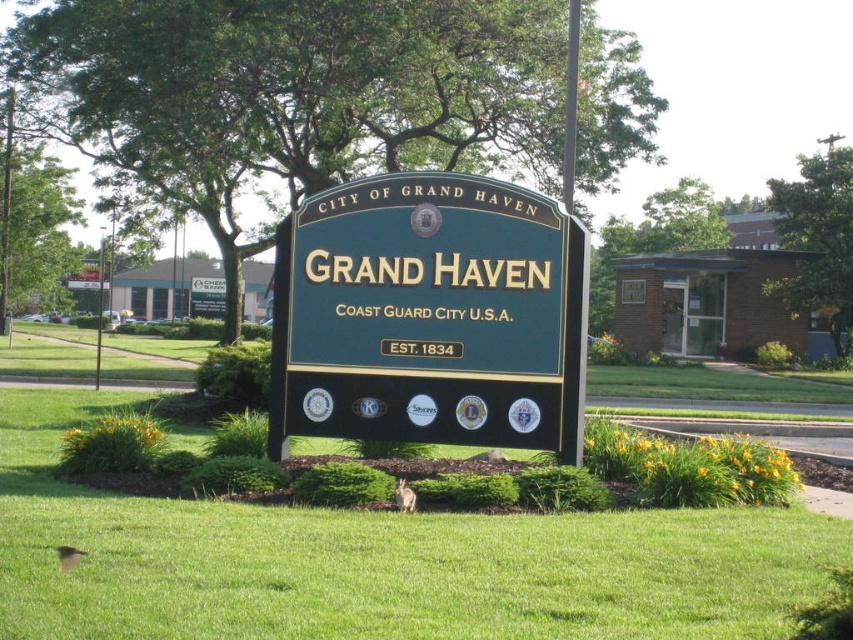
Question: Among these objects, which one is nearest to the camera?

Choices:
 (A) green polished wood sign at center
 (B) green grass at center

Answer: (B)

Question: Considering the relative positions of green grass at center and green polished wood sign at center in the image provided, where is green grass at center located with respect to green polished wood sign at center?

Choices:
 (A) right
 (B) left

Answer: (B)

Question: Is green grass at center behind green polished wood sign at center?

Choices:
 (A) no
 (B) yes

Answer: (A)

Question: Which point is closer to the camera?

Choices:
 (A) green polished wood sign at center
 (B) green grass at center

Answer: (B)

Question: Which point is closer to the camera?

Choices:
 (A) (279, 554)
 (B) (282, 394)

Answer: (A)

Question: Is green grass at center thinner than green polished wood sign at center?

Choices:
 (A) yes
 (B) no

Answer: (B)